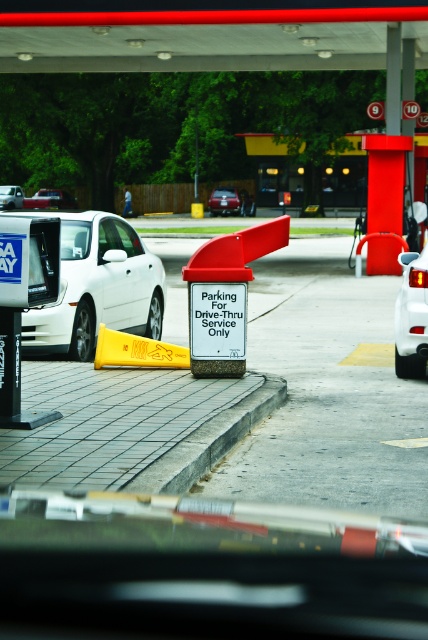
Question: Does yellow plastic cone at center have a greater width compared to matte white sedan at center?

Choices:
 (A) no
 (B) yes

Answer: (B)

Question: Estimate the real-world distances between objects in this image. Which object is farther from the white matte car at right?

Choices:
 (A) white matte car at left
 (B) yellow plastic cone at center
 (C) gray concrete curb at lower center

Answer: (A)

Question: Which object is closer to the camera taking this photo?

Choices:
 (A) gray concrete curb at lower center
 (B) matte white sedan at center

Answer: (A)

Question: Which point is closer to the camera?

Choices:
 (A) (253, 410)
 (B) (121, 250)

Answer: (A)

Question: Where is yellow plastic cone at center located in relation to shiny metallic sedan at center in the image?

Choices:
 (A) left
 (B) right

Answer: (A)

Question: Is white matte car at right above yellow plastic cone at center?

Choices:
 (A) yes
 (B) no

Answer: (A)